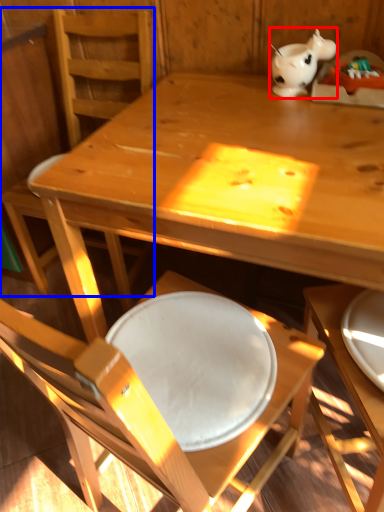
Question: Among these objects, which one is farthest to the camera, tableware (highlighted by a red box) or chair (highlighted by a blue box)?

Choices:
 (A) tableware
 (B) chair

Answer: (A)